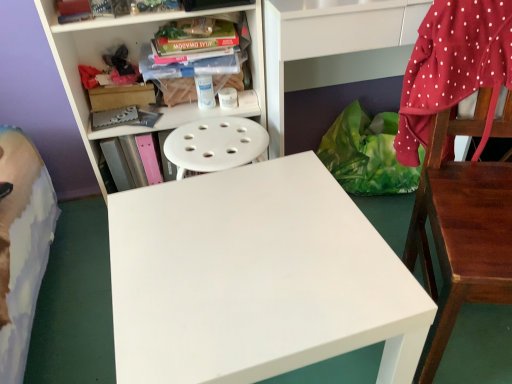
Question: Is the depth of pink matte book at center-left, which is counted as the second book, starting from the top, greater than that of red polka dot fabric at right?

Choices:
 (A) no
 (B) yes

Answer: (B)

Question: Considering the relative sizes of pink matte book at center-left, which is counted as the second book, starting from the top, and red polka dot fabric at right in the image provided, is pink matte book at center-left, which is counted as the second book, starting from the top, taller than red polka dot fabric at right?

Choices:
 (A) no
 (B) yes

Answer: (A)

Question: Is pink matte book at center-left, the 1th book from the bottom, closer to the viewer compared to red polka dot fabric at right?

Choices:
 (A) no
 (B) yes

Answer: (A)

Question: Considering the relative sizes of pink matte book at center-left, which is counted as the second book, starting from the top, and red polka dot fabric at right in the image provided, is pink matte book at center-left, which is counted as the second book, starting from the top, wider than red polka dot fabric at right?

Choices:
 (A) no
 (B) yes

Answer: (B)

Question: From the image's perspective, does pink matte book at center-left, the 1th book from the bottom, appear higher than red polka dot fabric at right?

Choices:
 (A) yes
 (B) no

Answer: (B)

Question: Considering the relative sizes of pink matte book at center-left, which is counted as the second book, starting from the top, and red polka dot fabric at right in the image provided, is pink matte book at center-left, which is counted as the second book, starting from the top, shorter than red polka dot fabric at right?

Choices:
 (A) no
 (B) yes

Answer: (B)

Question: Is wooden chair at right to the right of pink matte book at center-left, the 1th book from the bottom, from the viewer's perspective?

Choices:
 (A) no
 (B) yes

Answer: (B)

Question: Can you confirm if wooden chair at right is taller than pink matte book at center-left, which is counted as the second book, starting from the top?

Choices:
 (A) no
 (B) yes

Answer: (B)

Question: Would you consider wooden chair at right to be distant from pink matte book at center-left, which is counted as the second book, starting from the top?

Choices:
 (A) no
 (B) yes

Answer: (A)

Question: Does wooden chair at right have a larger size compared to pink matte book at center-left, which is counted as the second book, starting from the top?

Choices:
 (A) yes
 (B) no

Answer: (A)

Question: Does wooden chair at right have a smaller size compared to pink matte book at center-left, the 1th book from the bottom?

Choices:
 (A) no
 (B) yes

Answer: (A)

Question: From a real-world perspective, is wooden chair at right on pink matte book at center-left, the 1th book from the bottom?

Choices:
 (A) yes
 (B) no

Answer: (A)

Question: Is wooden chair at right positioned with its back to green plastic bag at lower right?

Choices:
 (A) no
 (B) yes

Answer: (B)